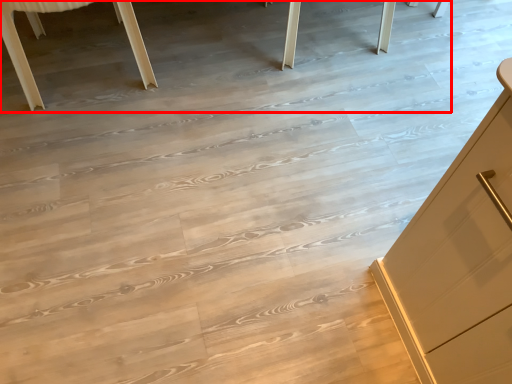
Question: From the image's perspective, considering the relative positions of table (annotated by the red box) and furniture in the image provided, where is table (annotated by the red box) located with respect to the staircase?

Choices:
 (A) above
 (B) below

Answer: (A)